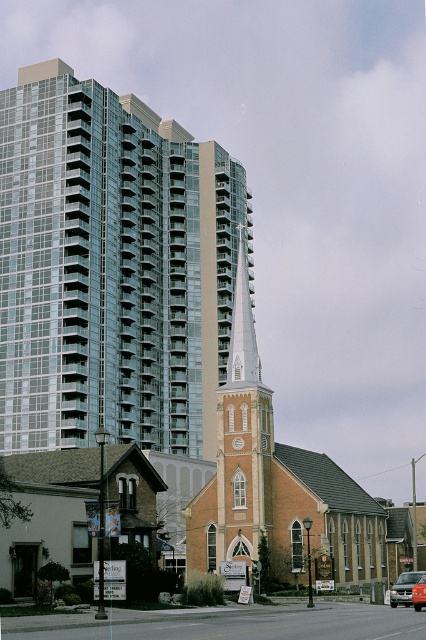
You are driving a metallic silver van at center and want to park it behind the smooth white spire at center. Is this possible given their positions?

The smooth white spire at center is closer to you than the metallic silver van at center, so you cannot park the metallic silver van at center behind the smooth white spire at center because the spire is in front of the van.

You are standing at point (x=112, y=268) in this urban scene. You see the glassy steel building at upper left. What is the nearest object to you?

The nearest object to you at point (x=112, y=268) is the glassy steel building at upper left because it is located at that exact coordinate.